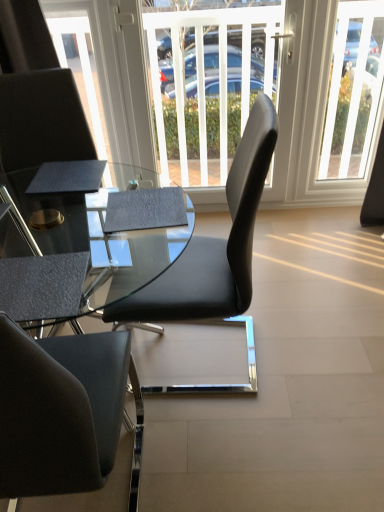
Question: Should I look upward or downward to see black leather chair at center, the 1th chair viewed from the right?

Choices:
 (A) up
 (B) down

Answer: (B)

Question: From the image's perspective, does black leather chair at left, which ranks as the 1th chair in left-to-right order, appear higher than matte black glass table at center?

Choices:
 (A) no
 (B) yes

Answer: (B)

Question: Is black leather chair at left, which ranks as the 1th chair in left-to-right order, positioned in front of matte black glass table at center?

Choices:
 (A) yes
 (B) no

Answer: (B)

Question: Is matte black glass table at center at the back of black leather chair at left, which ranks as the 1th chair in left-to-right order?

Choices:
 (A) no
 (B) yes

Answer: (A)

Question: Does black leather chair at left, placed as the 2th chair when sorted from right to left, appear on the left side of matte black glass table at center?

Choices:
 (A) yes
 (B) no

Answer: (A)

Question: From a real-world perspective, is black leather chair at left, placed as the 2th chair when sorted from right to left, positioned over matte black glass table at center based on gravity?

Choices:
 (A) yes
 (B) no

Answer: (A)

Question: Can you confirm if black leather chair at left, placed as the 2th chair when sorted from right to left, is positioned to the right of matte black glass table at center?

Choices:
 (A) no
 (B) yes

Answer: (A)

Question: Is matte black glass table at center positioned behind black leather chair at left, which ranks as the 1th chair in left-to-right order?

Choices:
 (A) no
 (B) yes

Answer: (A)

Question: Are matte black glass table at center and black leather chair at left, which ranks as the 1th chair in left-to-right order, located far from each other?

Choices:
 (A) yes
 (B) no

Answer: (B)

Question: Can you confirm if matte black glass table at center is positioned to the right of black leather chair at left, which ranks as the 1th chair in left-to-right order?

Choices:
 (A) yes
 (B) no

Answer: (A)

Question: Can you confirm if matte black glass table at center is smaller than black leather chair at left, which ranks as the 1th chair in left-to-right order?

Choices:
 (A) no
 (B) yes

Answer: (A)

Question: Considering the relative sizes of matte black glass table at center and black leather chair at left, which ranks as the 1th chair in left-to-right order, in the image provided, is matte black glass table at center wider than black leather chair at left, which ranks as the 1th chair in left-to-right order,?

Choices:
 (A) no
 (B) yes

Answer: (B)

Question: From the image's perspective, does matte black glass table at center appear lower than black leather chair at left, which ranks as the 1th chair in left-to-right order?

Choices:
 (A) no
 (B) yes

Answer: (B)

Question: From the image's perspective, is textured black armchair at lower left over black leather chair at left, placed as the 2th chair when sorted from right to left?

Choices:
 (A) yes
 (B) no

Answer: (B)